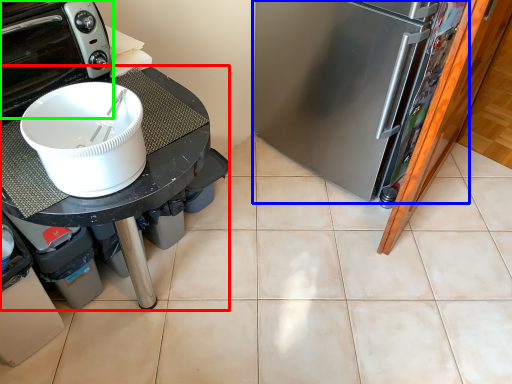
Question: Which is nearer to the table (highlighted by a red box)? refrigerator (highlighted by a blue box) or home appliance (highlighted by a green box).

Choices:
 (A) refrigerator
 (B) home appliance

Answer: (B)